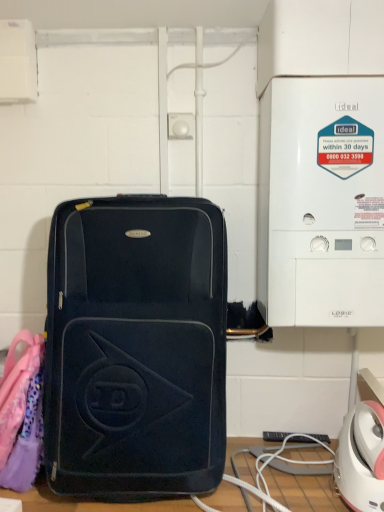
Question: Is matte black suitcase at center bigger than white plastic boiler at right?

Choices:
 (A) yes
 (B) no

Answer: (A)

Question: Does matte black suitcase at center have a greater height compared to white plastic boiler at right?

Choices:
 (A) no
 (B) yes

Answer: (A)

Question: Can you confirm if matte black suitcase at center is thinner than white plastic boiler at right?

Choices:
 (A) yes
 (B) no

Answer: (B)

Question: Is matte black suitcase at center oriented away from white plastic boiler at right?

Choices:
 (A) no
 (B) yes

Answer: (A)

Question: Would you say white plastic boiler at right is part of matte black suitcase at center's contents?

Choices:
 (A) no
 (B) yes

Answer: (A)

Question: Is matte black suitcase at center not inside white plastic boiler at right?

Choices:
 (A) yes
 (B) no

Answer: (A)

Question: Could you tell me if white plastic boiler at right is turned towards matte black suitcase at center?

Choices:
 (A) yes
 (B) no

Answer: (B)

Question: Can you see white plastic boiler at right touching matte black suitcase at center?

Choices:
 (A) yes
 (B) no

Answer: (B)

Question: Is white plastic boiler at right completely or partially outside of matte black suitcase at center?

Choices:
 (A) yes
 (B) no

Answer: (A)

Question: Considering the relative sizes of white plastic boiler at right and matte black suitcase at center in the image provided, is white plastic boiler at right shorter than matte black suitcase at center?

Choices:
 (A) no
 (B) yes

Answer: (A)

Question: From a real-world perspective, is white plastic boiler at right on matte black suitcase at center?

Choices:
 (A) no
 (B) yes

Answer: (B)

Question: From the image's perspective, does white plastic boiler at right appear higher than matte black suitcase at center?

Choices:
 (A) no
 (B) yes

Answer: (B)

Question: Considering the positions of white plastic boiler at right and matte black suitcase at center in the image, is white plastic boiler at right wider or thinner than matte black suitcase at center?

Choices:
 (A) thin
 (B) wide

Answer: (A)